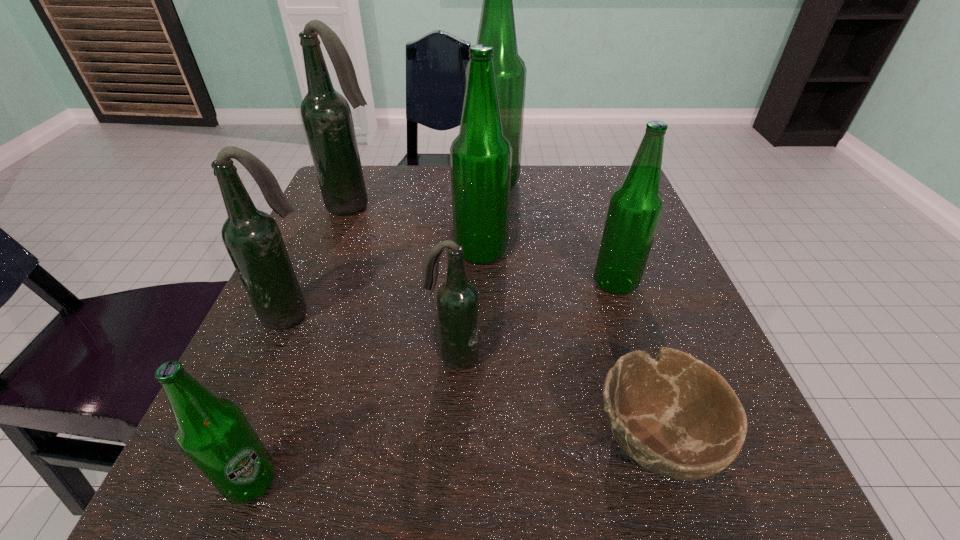
Identify the location of bowl located at the right edge. (674, 415).

I want to click on object that is at the far left corner, so click(x=326, y=115).

Where is `object located at the near left corner`? object located at the near left corner is located at coordinates click(x=214, y=433).

This screenshot has height=540, width=960. In order to click on object located at the near right corner in this screenshot , I will do `click(674, 415)`.

Find the location of a particular element. The width and height of the screenshot is (960, 540). free space at the far edge of the desktop is located at coordinates (565, 192).

Image resolution: width=960 pixels, height=540 pixels. In order to click on vacant space at the near edge in this screenshot , I will do `click(502, 489)`.

In the image, there is a desktop. At what (x,y) coordinates should I click in order to perform the action: click on blank space at the left edge. Please return your answer as a coordinate pair (x, y). Looking at the image, I should click on (345, 232).

Locate an element on the screen. Image resolution: width=960 pixels, height=540 pixels. free space at the far left corner of the desktop is located at coordinates (370, 182).

Identify the location of free space at the near right corner. The image size is (960, 540). (713, 492).

Where is `empty location between the tallest object and the second smallest green beer bottle`? Image resolution: width=960 pixels, height=540 pixels. empty location between the tallest object and the second smallest green beer bottle is located at coordinates (554, 233).